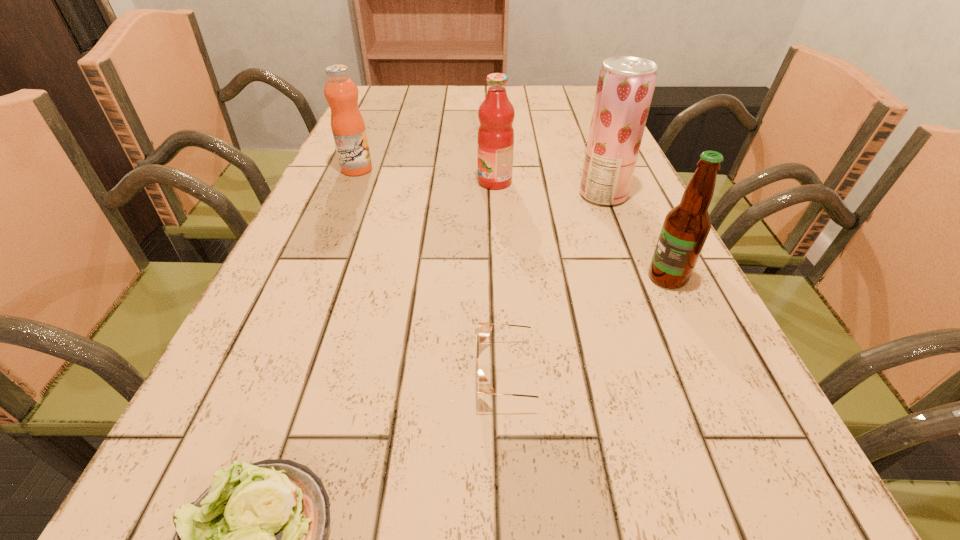
Where is `vacant region at the left edge of the desktop`? vacant region at the left edge of the desktop is located at coordinates (322, 303).

Identify the location of vacant space at the right edge. (629, 227).

In order to click on vacant space in between the rightmost fruit juice and the beer bottle in this screenshot , I will do `click(636, 236)`.

In order to click on free space between the sunglasses and the second fruit juice from left to right in this screenshot , I will do `click(505, 278)`.

Locate an element on the screen. vacant region between the fourth farthest object and the sunglasses is located at coordinates (591, 325).

You are a GUI agent. You are given a task and a screenshot of the screen. Output one action in this format:
    pyautogui.click(x=<x>, y=<y>)
    Task: Click on the free space between the beer bottle and the second fruit juice from left to right
    The image size is (960, 540).
    Given the screenshot: What is the action you would take?
    pyautogui.click(x=581, y=230)

Image resolution: width=960 pixels, height=540 pixels. Find the location of `vacant space that's between the second nearest object and the leftmost fruit juice`. vacant space that's between the second nearest object and the leftmost fruit juice is located at coordinates (436, 271).

Where is `vacant space in between the fourth farthest object and the leftmost fruit juice`? The height and width of the screenshot is (540, 960). vacant space in between the fourth farthest object and the leftmost fruit juice is located at coordinates (513, 224).

This screenshot has width=960, height=540. Identify the location of vacant space that's between the second fruit juice from right to left and the fifth farthest object. (505, 278).

This screenshot has width=960, height=540. I want to click on object that stands as the third closest to the second nearest object, so click(x=625, y=87).